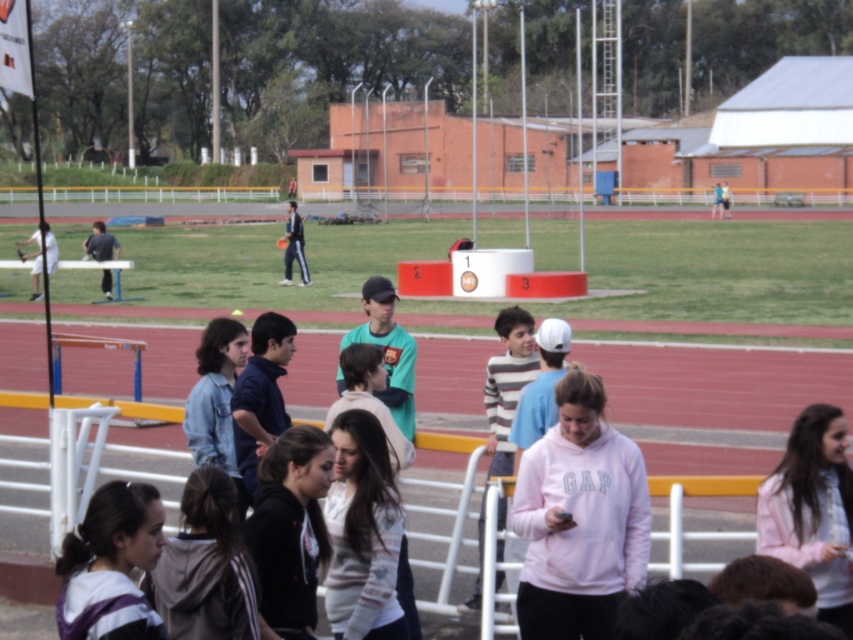
Question: Which object is farther from the camera taking this photo?

Choices:
 (A) pink fleece sweatshirt at center
 (B) dark blue suit at center
 (C) purple striped hoodie at lower left

Answer: (B)

Question: Considering the real-world distances, which object is farthest from the pink fleece sweatshirt at center?

Choices:
 (A) pink fabric jacket at lower right
 (B) white matte tennis racket at left

Answer: (B)

Question: Can you confirm if pink fleece sweatshirt at center is wider than dark blue suit at center?

Choices:
 (A) no
 (B) yes

Answer: (A)

Question: Among these points, which one is farthest from the camera?

Choices:
 (A) (161, 538)
 (B) (281, 237)
 (C) (33, 234)

Answer: (B)

Question: Does pink fabric jacket at lower right have a greater width compared to purple striped hoodie at lower left?

Choices:
 (A) yes
 (B) no

Answer: (B)

Question: Does pink fabric jacket at lower right have a larger size compared to dark blue suit at center?

Choices:
 (A) no
 (B) yes

Answer: (A)